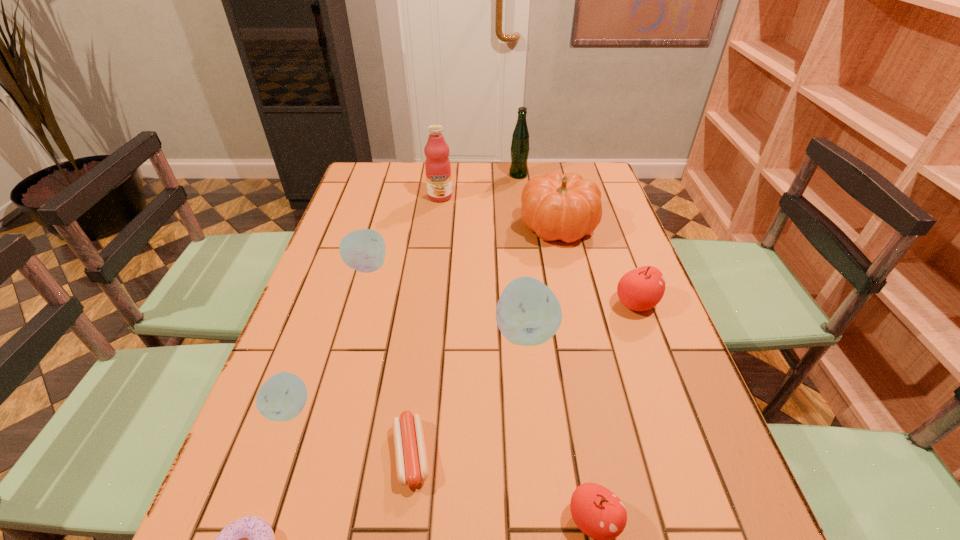
Where is `apple that is the closest to the left red apple`? apple that is the closest to the left red apple is located at coordinates (528, 313).

The image size is (960, 540). Identify the location of the second closest apple relative to the fourth farthest apple. (528, 313).

Locate an element on the screen. the third closest white apple to the nearer red apple is located at coordinates (363, 250).

Identify which white apple is located as the nearest to the fourth farthest object. Please provide its 2D coordinates. Your answer should be formatted as a tuple, i.e. [(x, y)], where the tuple contains the x and y coordinates of a point satisfying the conditions above.

[(528, 313)]

Find the location of a particular element. free location that satisfies the following two spatial constraints: 1. on the back side of the beer bottle; 2. on the left side of the smallest white apple is located at coordinates (373, 175).

The height and width of the screenshot is (540, 960). Identify the location of free spot that satisfies the following two spatial constraints: 1. on the label of the pumpkin; 2. on the left side of the fruit juice. (436, 226).